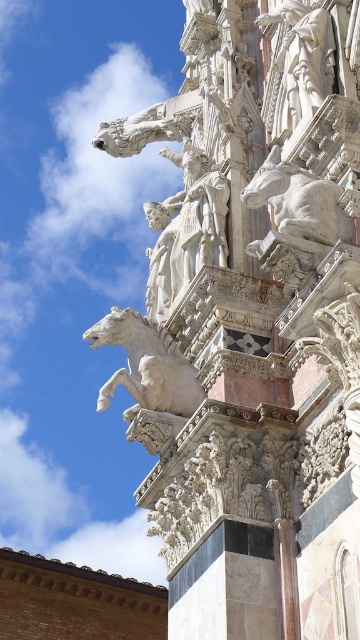
Question: Which object appears closest to the camera in this image?

Choices:
 (A) white marble horse at upper center
 (B) white marble statue at center

Answer: (A)

Question: Among these objects, which one is nearest to the camera?

Choices:
 (A) white marble statue at center
 (B) white marble horse at upper center

Answer: (B)

Question: Is white marble statue at center thinner than white marble horse at upper center?

Choices:
 (A) no
 (B) yes

Answer: (B)

Question: Is white marble statue at center positioned behind white marble horse at upper center?

Choices:
 (A) yes
 (B) no

Answer: (A)

Question: Does white marble statue at center come in front of white marble horse at upper center?

Choices:
 (A) yes
 (B) no

Answer: (B)

Question: Which point is closer to the camera?

Choices:
 (A) white marble statue at center
 (B) white marble horse at upper center

Answer: (B)